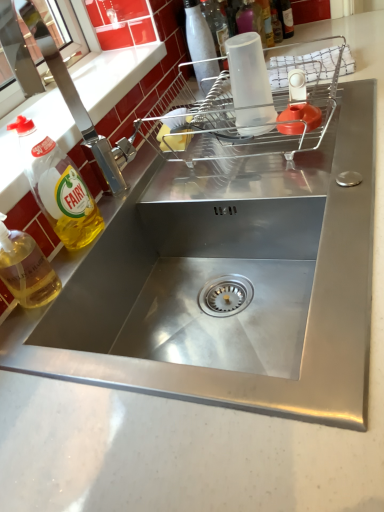
The width and height of the screenshot is (384, 512). I want to click on free spot above brushed metal tap at left (from a real-world perspective), so click(65, 103).